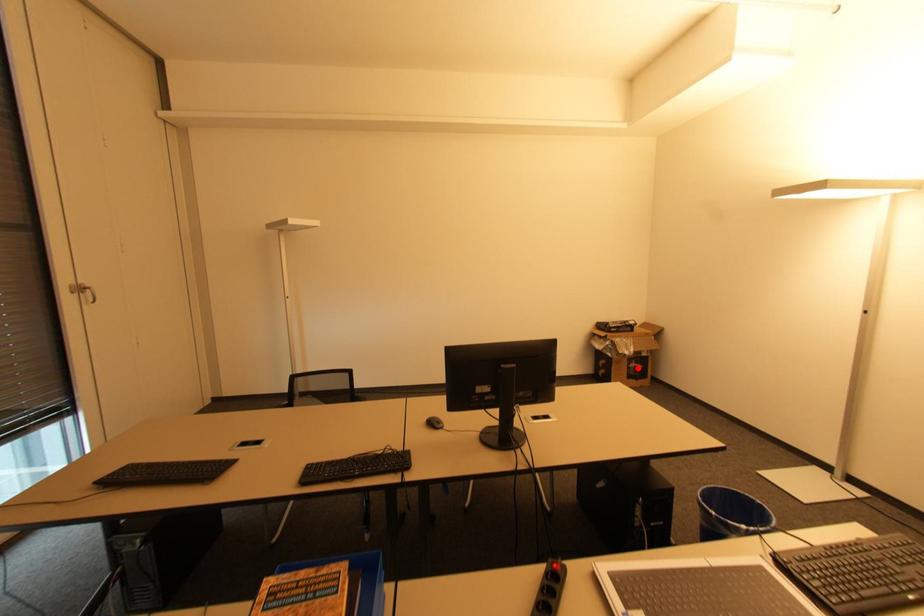
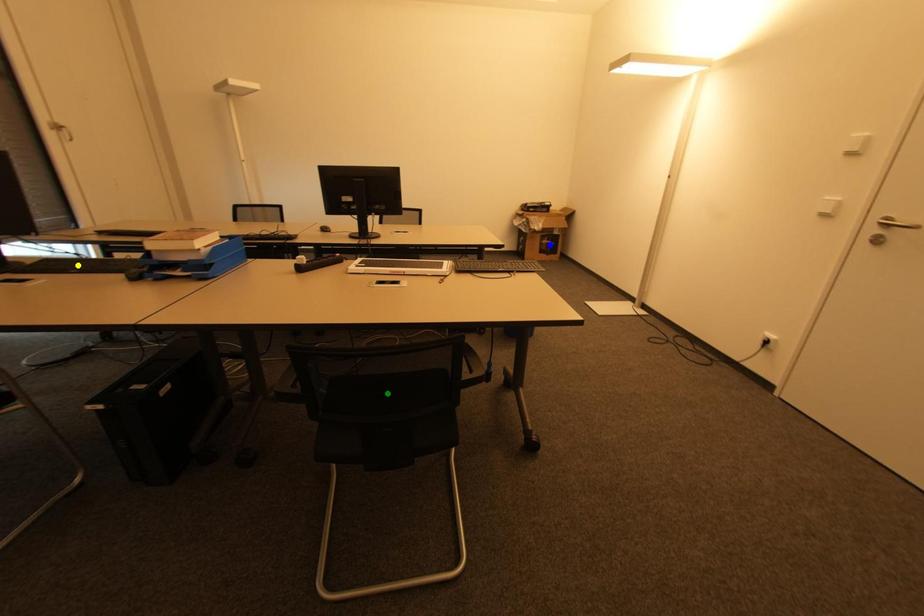
Question: I am providing you with two images of the same scene from different viewpoints. A red point is marked on the first image. You are given multiple points on the second image. Which point in image 2 represents the same 3d spot as the red point in image 1?

Choices:
 (A) blue point
 (B) green point
 (C) yellow point

Answer: (A)